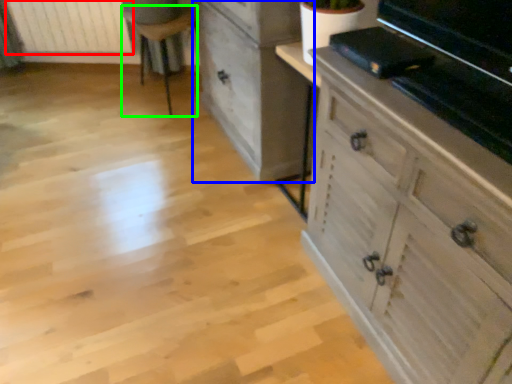
Question: Based on their relative distances, which object is nearer to radiator (highlighted by a red box)? Choose from chest of drawers (highlighted by a blue box) and furniture (highlighted by a green box).

Choices:
 (A) chest of drawers
 (B) furniture

Answer: (B)